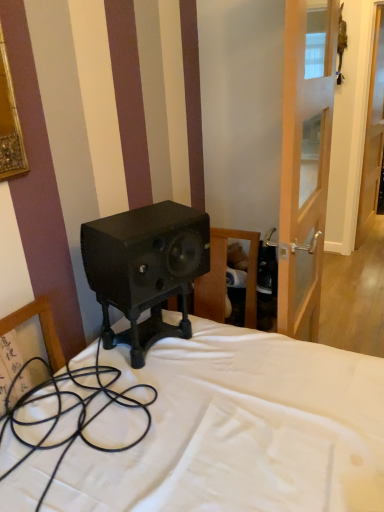
Question: Looking at the image, does matte black speaker at center seem bigger or smaller compared to transparent glass door at right?

Choices:
 (A) big
 (B) small

Answer: (B)

Question: Is matte black speaker at center to the left or to the right of transparent glass door at right in the image?

Choices:
 (A) left
 (B) right

Answer: (A)

Question: Based on their relative distances, which object is nearer to the black rubber cable at lower left?

Choices:
 (A) matte black speaker at center
 (B) transparent glass door at right

Answer: (A)

Question: Considering the real-world distances, which object is closest to the transparent glass door at right?

Choices:
 (A) matte black speaker at center
 (B) black rubber cable at lower left

Answer: (A)